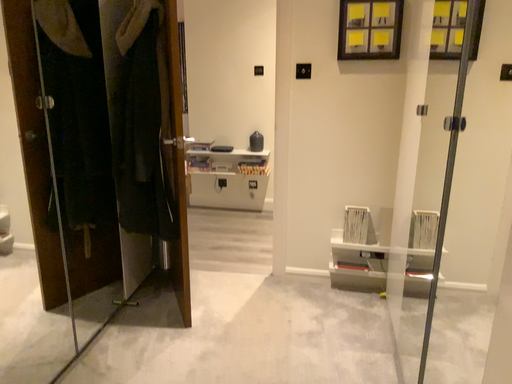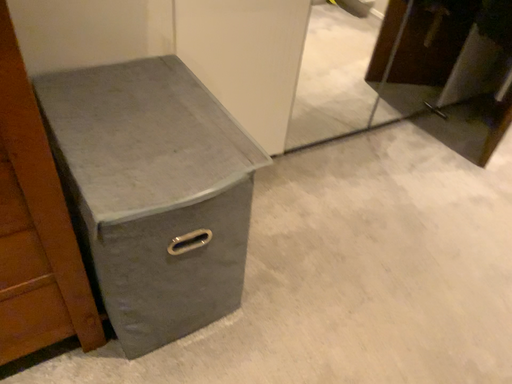
Question: How did the camera likely rotate when shooting the video?

Choices:
 (A) rotated upward
 (B) rotated downward

Answer: (B)